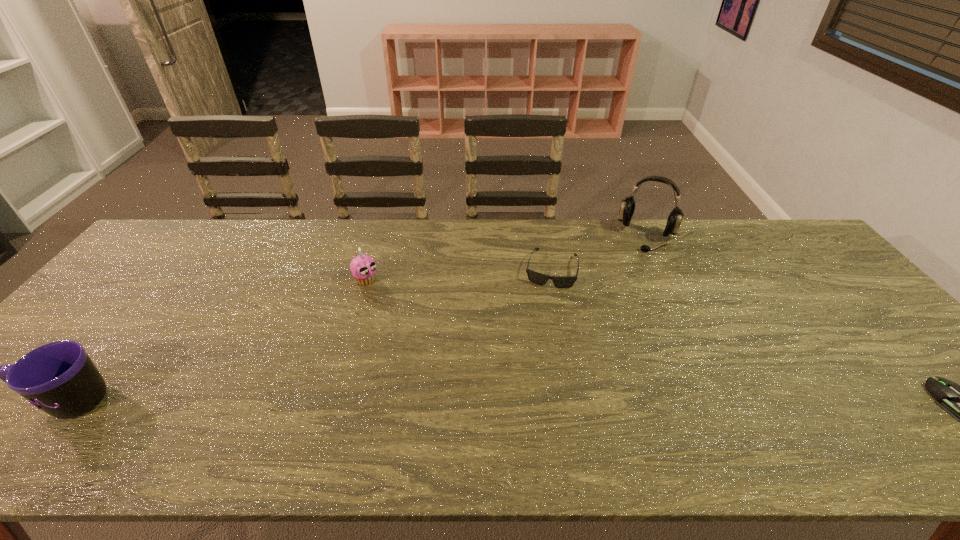
I want to click on object identified as the closest to the second shortest object, so click(627, 208).

The height and width of the screenshot is (540, 960). I want to click on object that is the fourth closest to the fourth object from right to left, so click(959, 401).

Image resolution: width=960 pixels, height=540 pixels. I want to click on free spot that satisfies the following two spatial constraints: 1. on the back side of the third object from right to left; 2. on the right side of the fourth object from right to left, so click(370, 269).